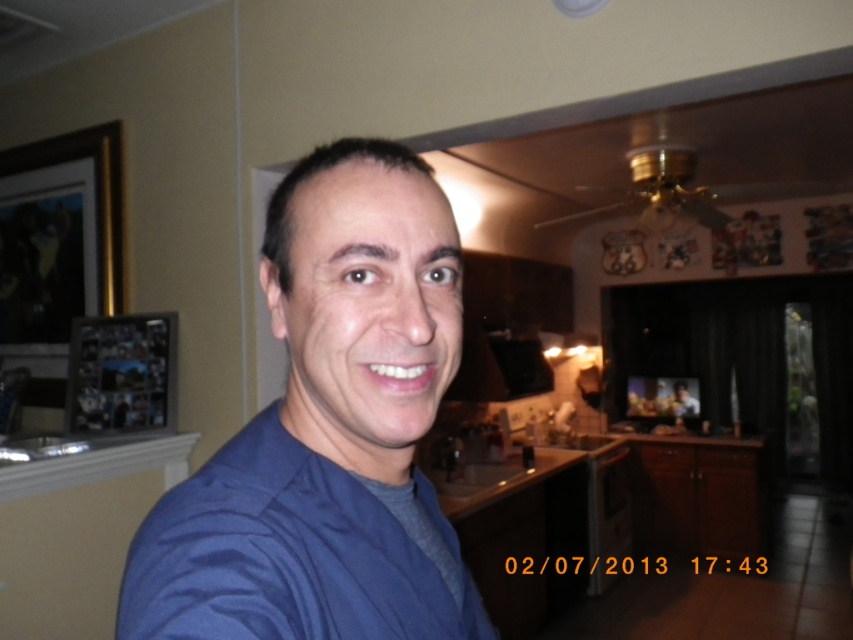
Does blue fabric shirt at center have a smaller size compared to blue smooth shirt at center?

No.

Can you confirm if blue fabric shirt at center is taller than blue smooth shirt at center?

Yes.

Image resolution: width=853 pixels, height=640 pixels. What are the coordinates of `blue fabric shirt at center` in the screenshot? It's located at (328, 433).

Does blue fabric shirt at center have a greater width compared to wooden photo frame at left?

No.

Is blue fabric shirt at center further to camera compared to wooden photo frame at left?

No, it is not.

In order to click on blue fabric shirt at center in this screenshot , I will do `click(328, 433)`.

Does blue smooth shirt at center have a lesser width compared to wooden photo frame at left?

Yes.

Is the position of blue smooth shirt at center more distant than that of wooden photo frame at left?

No, it is not.

Find the location of a particular element. Image resolution: width=853 pixels, height=640 pixels. blue smooth shirt at center is located at coordinates (277, 554).

The image size is (853, 640). Find the location of `blue smooth shirt at center`. blue smooth shirt at center is located at coordinates (277, 554).